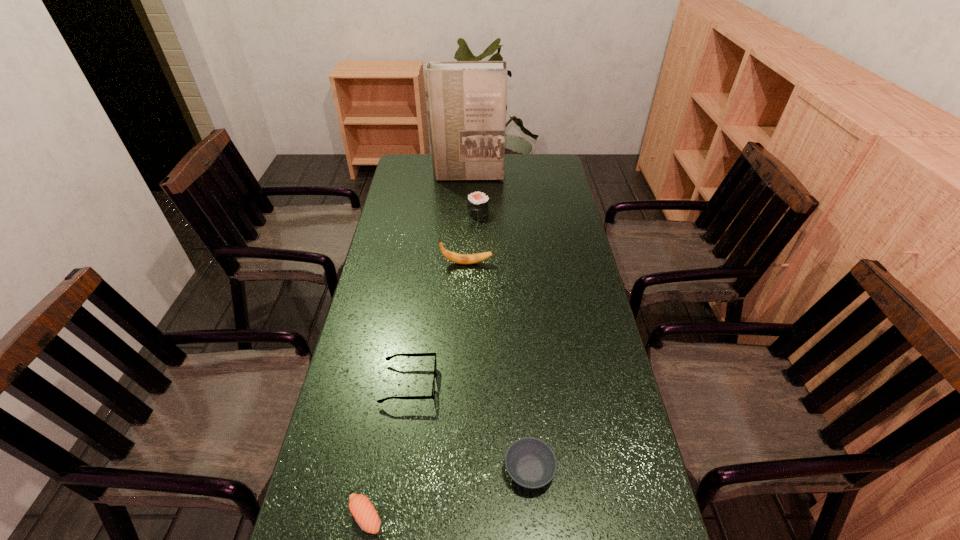
Where is `vacant point that satisfies the following two spatial constraints: 1. on the arms of the second nearest object; 2. on the right side of the third nearest object`? vacant point that satisfies the following two spatial constraints: 1. on the arms of the second nearest object; 2. on the right side of the third nearest object is located at coordinates (397, 470).

Where is `free space that satisfies the following two spatial constraints: 1. on the cover of the farthest object; 2. on the right side of the farther sushi`? This screenshot has height=540, width=960. free space that satisfies the following two spatial constraints: 1. on the cover of the farthest object; 2. on the right side of the farther sushi is located at coordinates (467, 213).

This screenshot has height=540, width=960. I want to click on vacant area that satisfies the following two spatial constraints: 1. on the arms of the spectacles; 2. on the back side of the fifth farthest object, so click(397, 470).